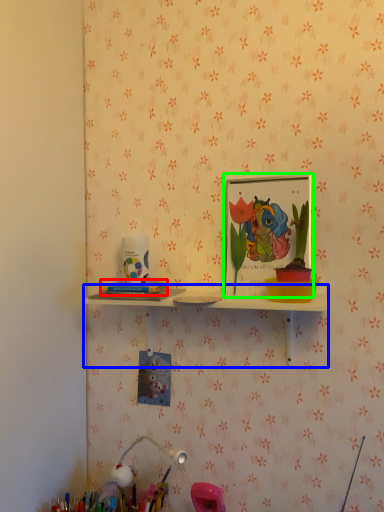
Question: Based on their relative distances, which object is nearer to stationery (highlighted by a red box)? Choose from shelf (highlighted by a blue box) and picture frame (highlighted by a green box).

Choices:
 (A) shelf
 (B) picture frame

Answer: (A)